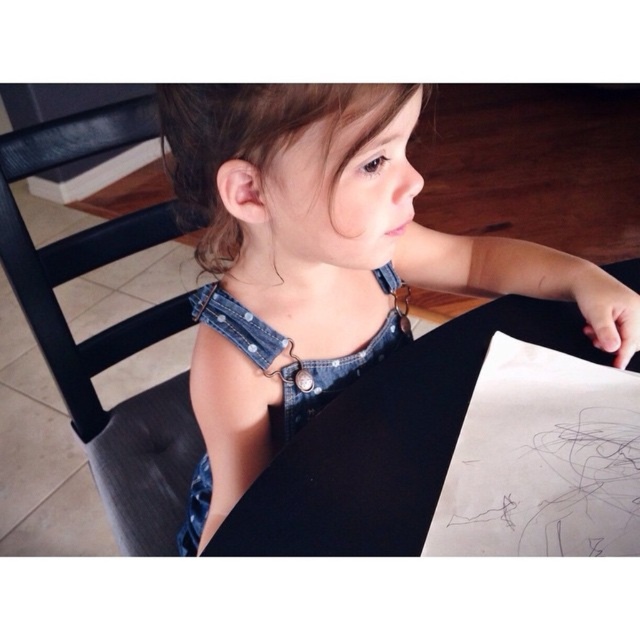
Measure the distance between denim dress at center and black leather chair at left.

A distance of 31.01 centimeters exists between denim dress at center and black leather chair at left.

Between denim dress at center and black leather chair at left, which one appears on the left side from the viewer's perspective?

black leather chair at left

Between point (252, 323) and point (115, 481), which one is positioned in front?

Positioned in front is point (252, 323).

At what (x,y) coordinates should I click in order to perform the action: click on denim dress at center. Please return your answer as a coordinate pair (x, y). Looking at the image, I should click on pyautogui.click(x=323, y=260).